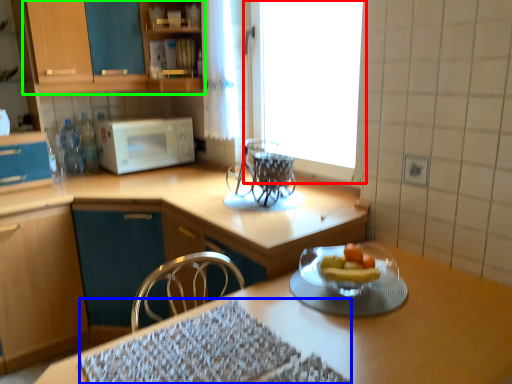
Question: Estimate the real-world distances between objects in this image. Which object is closer to window (highlighted by a red box), place mat (highlighted by a blue box) or cabinetry (highlighted by a green box)?

Choices:
 (A) place mat
 (B) cabinetry

Answer: (B)